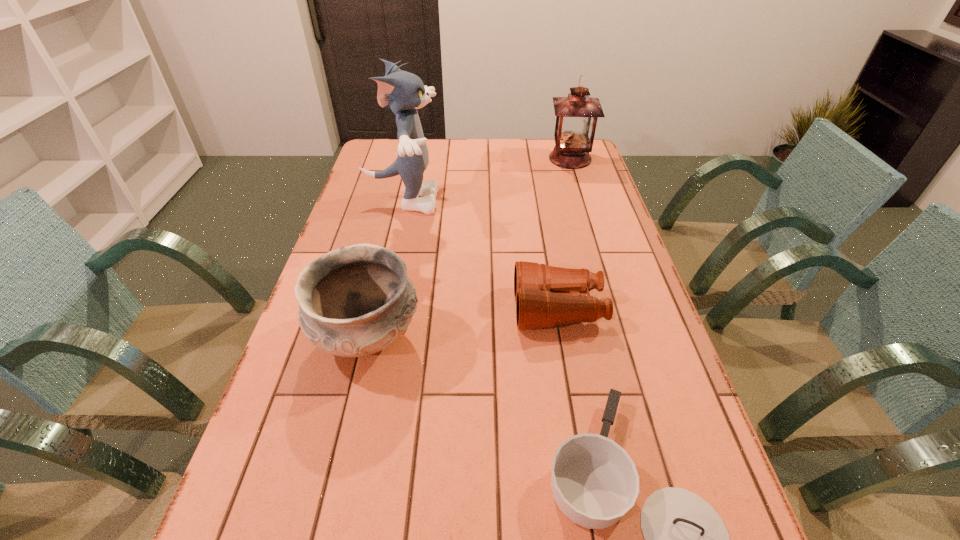
Image resolution: width=960 pixels, height=540 pixels. I want to click on cat, so click(403, 92).

I want to click on oil lamp, so [576, 115].

This screenshot has width=960, height=540. I want to click on pottery, so click(x=354, y=301).

At what (x,y) coordinates should I click in order to perform the action: click on binoculars. Please return your answer as a coordinate pair (x, y). This screenshot has height=540, width=960. Looking at the image, I should click on (546, 296).

Locate an element on the screen. This screenshot has width=960, height=540. vacant region located on the front-facing side of the cat is located at coordinates pos(542,201).

The image size is (960, 540). What are the coordinates of `free region located 0.380m on the left of the oil lamp` in the screenshot? It's located at (449, 159).

What are the coordinates of `vacant space located 0.120m on the right of the pottery` in the screenshot? It's located at (472, 338).

Where is `vacant area situated through the lenses of the binoculars`? The height and width of the screenshot is (540, 960). vacant area situated through the lenses of the binoculars is located at coordinates (383, 309).

Find the location of `free point located through the lenses of the binoculars`. free point located through the lenses of the binoculars is located at coordinates (480, 309).

What are the coordinates of `vacant region located through the lenses of the binoculars` in the screenshot? It's located at (449, 309).